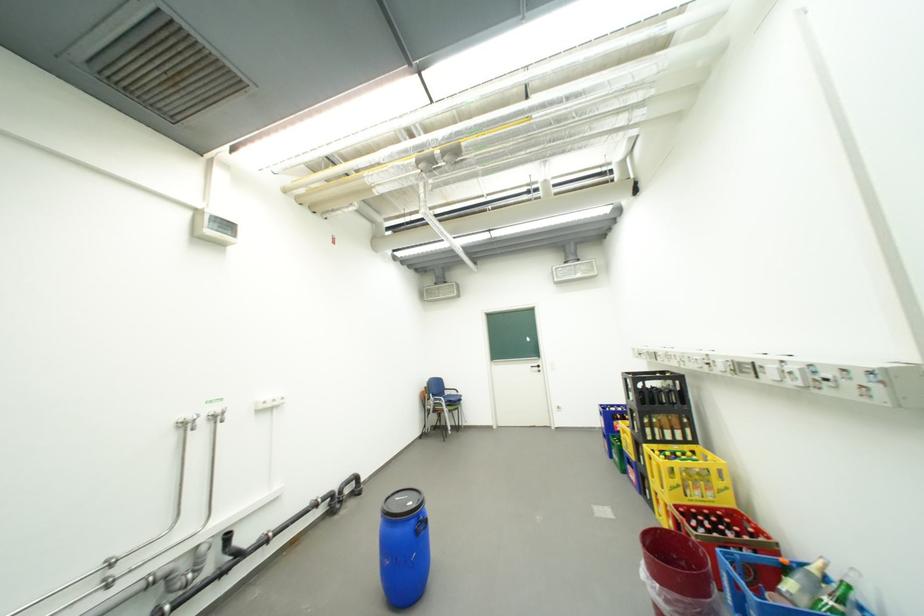
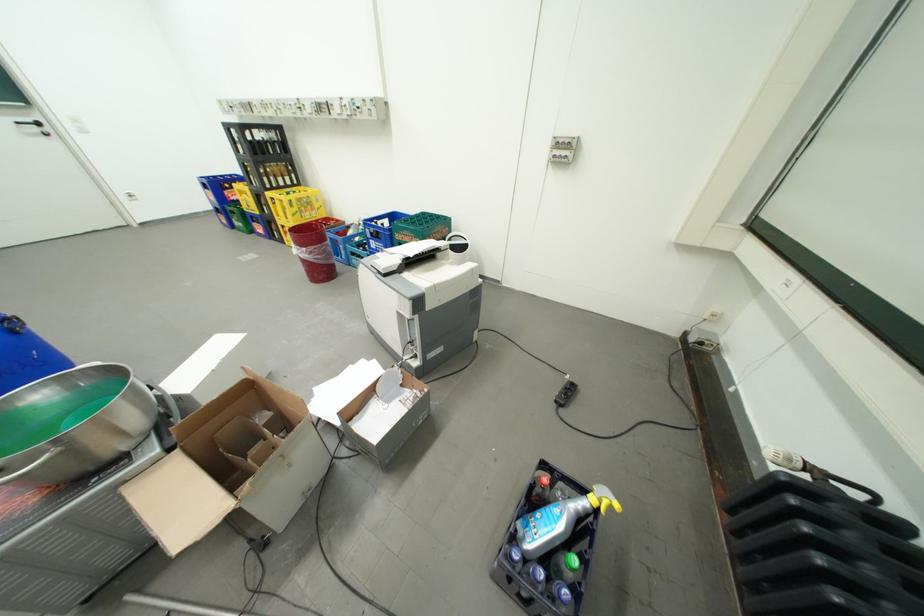
The point at (669, 586) is marked in the first image. Where is the corresponding point in the second image?

(314, 249)